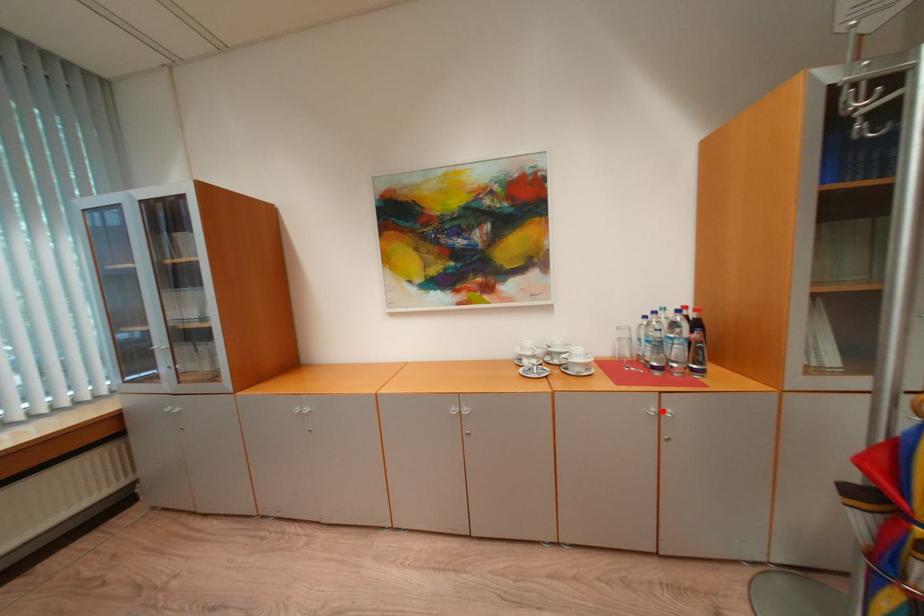
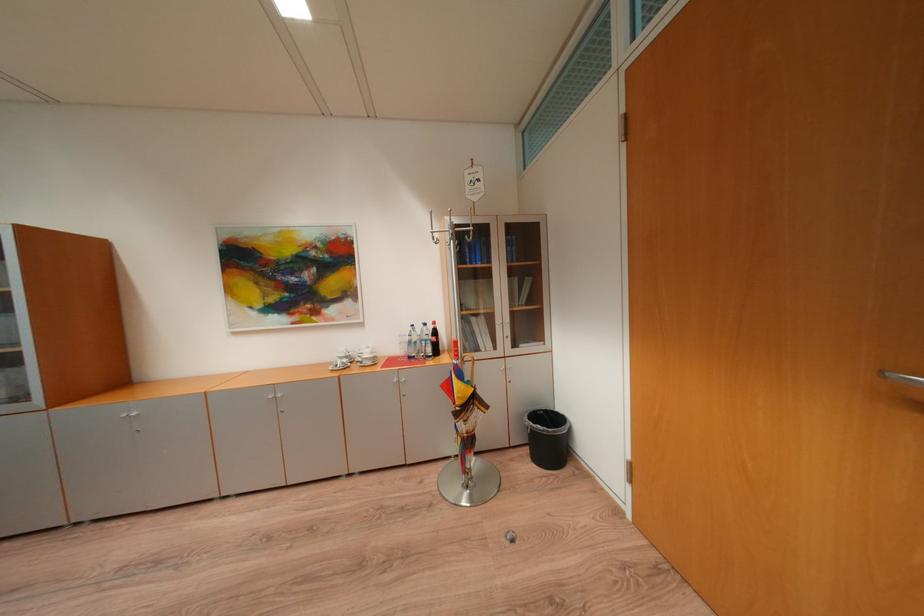
Question: I am providing you with two images of the same scene from different viewpoints. A red point is shown in image1. For the corresponding object point in image2, is it positioned nearer or farther from the camera?

Choices:
 (A) Nearer
 (B) Farther

Answer: (B)